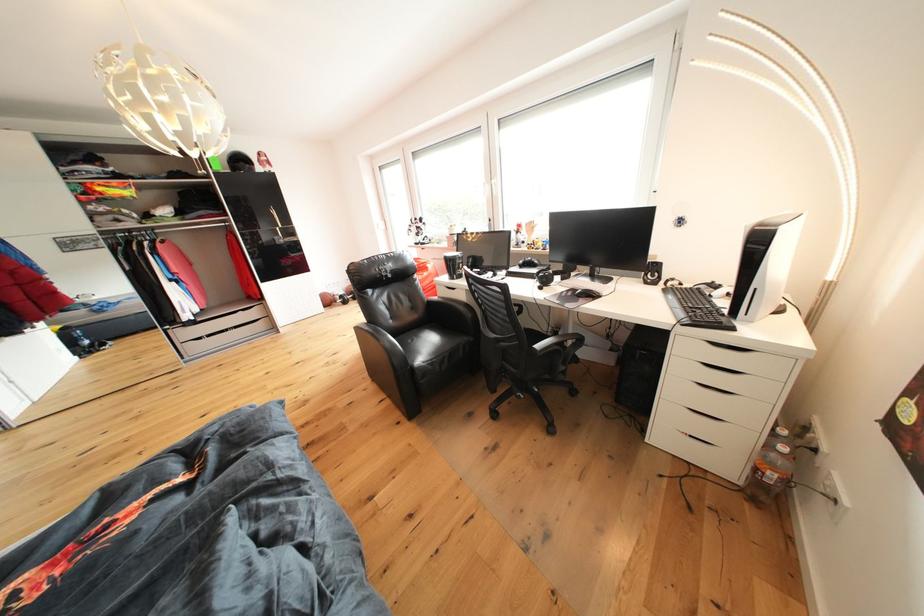
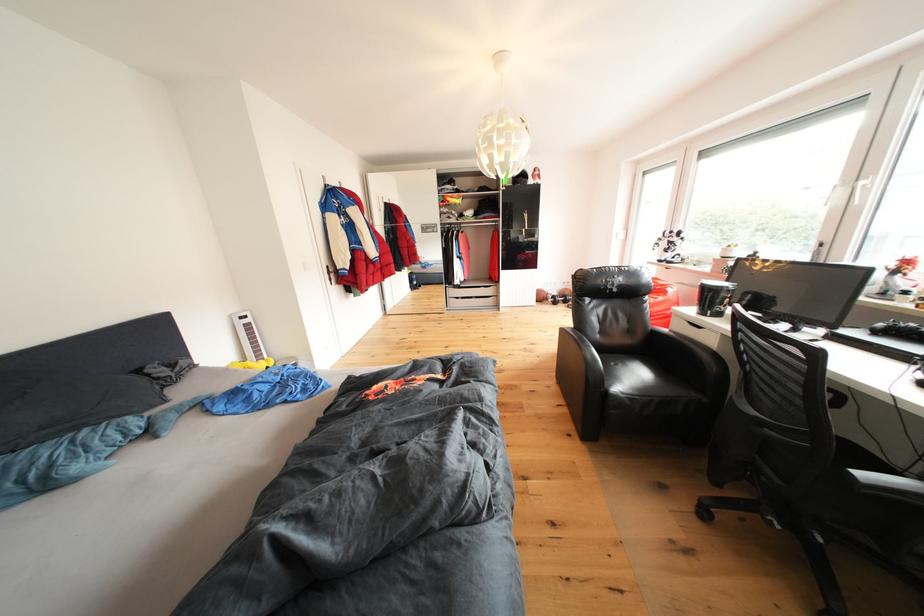
Find the pixel in the second image that matches point 464,278 in the first image.

(720, 313)